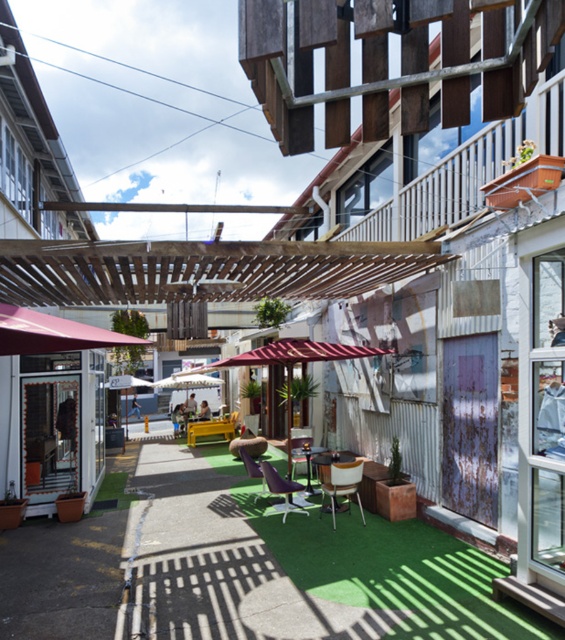
Question: Can you confirm if purple matte chair at center is positioned above metallic silver chair at center?

Choices:
 (A) no
 (B) yes

Answer: (A)

Question: Is green artificial turf at center further to camera compared to purple fabric chair at center?

Choices:
 (A) no
 (B) yes

Answer: (A)

Question: Does white leather chair at center appear on the left side of metallic silver chair at center?

Choices:
 (A) yes
 (B) no

Answer: (B)

Question: Considering the real-world distances, which object is closest to the purple fabric chair at center?

Choices:
 (A) metallic silver chair at center
 (B) green artificial turf at center

Answer: (A)

Question: Among these points, which one is farthest from the camera?

Choices:
 (A) (302, 461)
 (B) (347, 570)
 (C) (241, 451)
 (D) (292, 506)

Answer: (A)

Question: Estimate the real-world distances between objects in this image. Which object is closer to the purple matte chair at center?

Choices:
 (A) green artificial turf at center
 (B) purple fabric chair at center
 (C) metallic silver chair at center
 (D) white leather chair at center

Answer: (B)